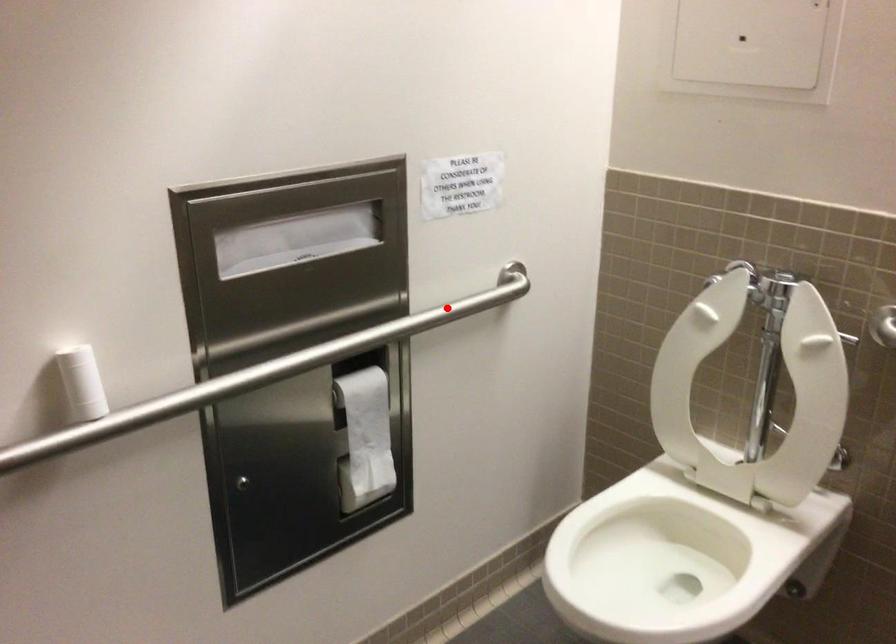
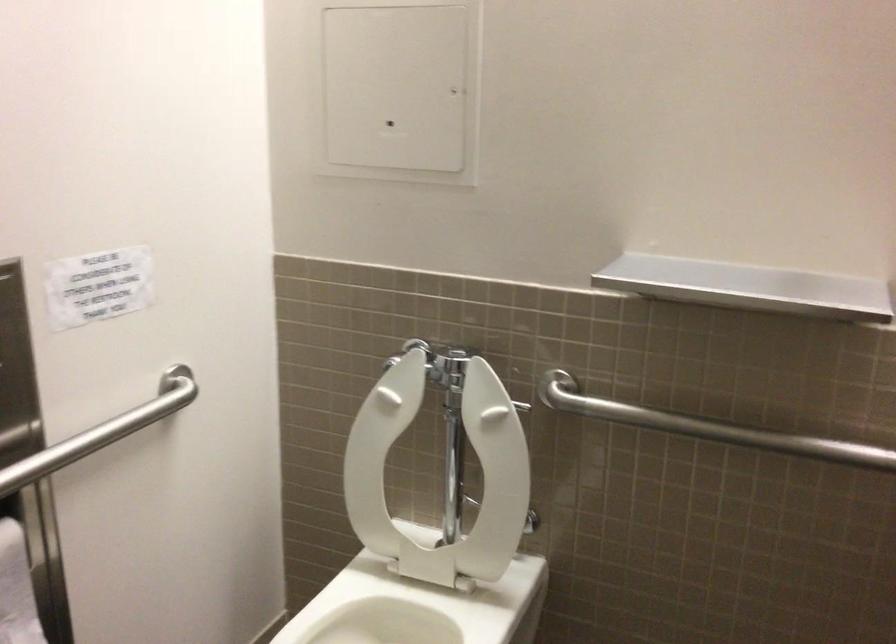
The point at the highlighted location is marked in the first image. Where is the corresponding point in the second image?

(102, 431)